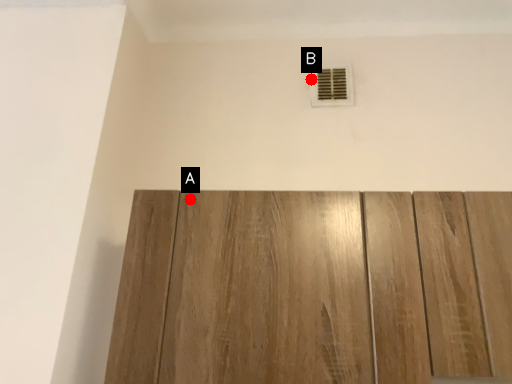
Question: Two points are circled on the image, labeled by A and B beside each circle. Which point is farther to the camera?

Choices:
 (A) A is further
 (B) B is further

Answer: (B)